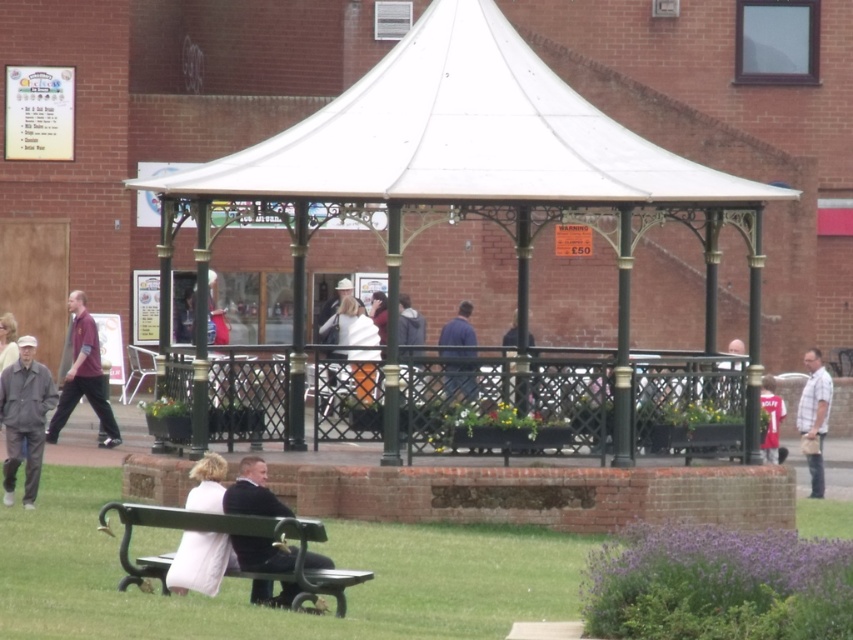
You are a photographer standing in front of the gazebo. You want to take a photo of the green grass at lower center and the dark suit at center. Which object is closer to the camera?

The dark suit at center is closer to the camera because the green grass at lower center is positioned under it.

You are planning to install a new lighting system for the white metal gazebo at center and the white fabric canopy at center. Based on their heights, which object requires taller mounting brackets?

The white metal gazebo at center requires taller mounting brackets because it is much taller than the white fabric canopy at center.